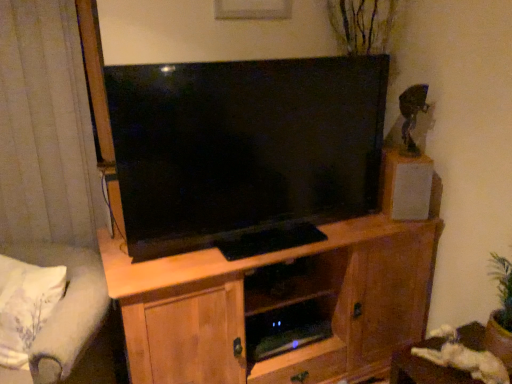
Question: Is light brown wood cabinet at center surrounded by white matte speaker at upper right?

Choices:
 (A) yes
 (B) no

Answer: (B)

Question: Would you consider white matte speaker at upper right to be distant from light brown wood cabinet at center?

Choices:
 (A) no
 (B) yes

Answer: (A)

Question: From a real-world perspective, is white matte speaker at upper right below light brown wood cabinet at center?

Choices:
 (A) yes
 (B) no

Answer: (B)

Question: Can you confirm if white matte speaker at upper right is taller than light brown wood cabinet at center?

Choices:
 (A) no
 (B) yes

Answer: (A)

Question: Is white matte speaker at upper right bigger than light brown wood cabinet at center?

Choices:
 (A) yes
 (B) no

Answer: (B)

Question: From a real-world perspective, is white matte speaker at upper right located higher than light brown wood cabinet at center?

Choices:
 (A) no
 (B) yes

Answer: (B)

Question: Can you confirm if gray fabric curtain at left is thinner than wooden table at lower right?

Choices:
 (A) yes
 (B) no

Answer: (A)

Question: Is gray fabric curtain at left not inside wooden table at lower right?

Choices:
 (A) no
 (B) yes

Answer: (B)

Question: Is gray fabric curtain at left far from wooden table at lower right?

Choices:
 (A) yes
 (B) no

Answer: (A)

Question: Is gray fabric curtain at left facing away from wooden table at lower right?

Choices:
 (A) no
 (B) yes

Answer: (A)

Question: Considering the relative sizes of gray fabric curtain at left and wooden table at lower right in the image provided, is gray fabric curtain at left bigger than wooden table at lower right?

Choices:
 (A) no
 (B) yes

Answer: (B)

Question: Considering the relative positions of gray fabric curtain at left and wooden table at lower right in the image provided, is gray fabric curtain at left in front of wooden table at lower right?

Choices:
 (A) yes
 (B) no

Answer: (B)

Question: From a real-world perspective, is light gray fabric studio couch at lower left physically below wooden table at lower right?

Choices:
 (A) yes
 (B) no

Answer: (B)